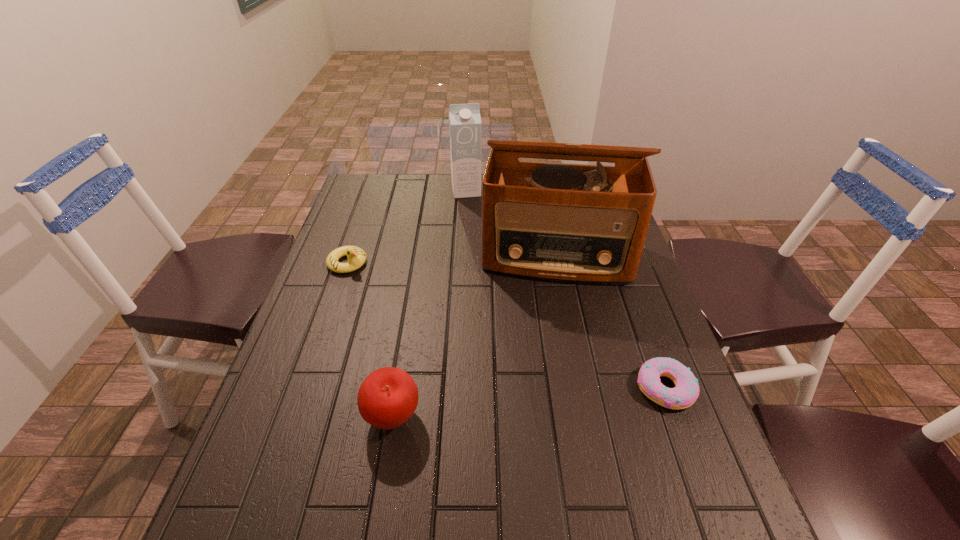
This screenshot has width=960, height=540. Find the location of `object positioned at the left edge`. object positioned at the left edge is located at coordinates (356, 256).

You are a GUI agent. You are given a task and a screenshot of the screen. Output one action in this format:
    pyautogui.click(x=<x>, y=<y>)
    Task: Click on the doughnut present at the right edge
    The height and width of the screenshot is (540, 960).
    Given the screenshot: What is the action you would take?
    pyautogui.click(x=686, y=391)

In order to click on radio receiver that is at the right edge in this screenshot , I will do `click(580, 223)`.

Where is `free space at the far edge of the desktop`? Image resolution: width=960 pixels, height=540 pixels. free space at the far edge of the desktop is located at coordinates (414, 175).

Where is `vacant region at the near edge of the desktop`? vacant region at the near edge of the desktop is located at coordinates (504, 487).

The width and height of the screenshot is (960, 540). In the image, there is a desktop. Identify the location of vacant space at the left edge. point(334,296).

This screenshot has width=960, height=540. Find the location of `blank area at the right edge`. blank area at the right edge is located at coordinates (701, 418).

At what (x,y) coordinates should I click in order to perform the action: click on vacant space at the far left corner of the desktop. Please return your answer as a coordinate pair (x, y). Looking at the image, I should click on (356, 207).

The image size is (960, 540). Identify the location of vacant space at the near left corner of the desktop. (305, 452).

At what (x,y) coordinates should I click in order to perform the action: click on unoccupied area between the doughnut and the apple. Please return your answer as a coordinate pair (x, y). This screenshot has width=960, height=540. Looking at the image, I should click on (528, 402).